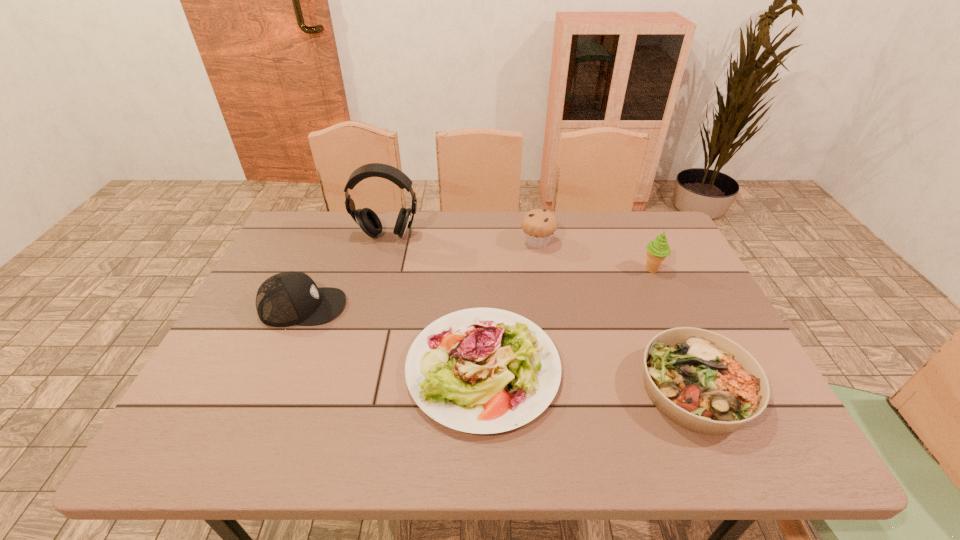
Image resolution: width=960 pixels, height=540 pixels. In the image, there is a desktop. Identify the location of blank space at the near edge. (628, 429).

At what (x,y) coordinates should I click in order to perform the action: click on vacant space at the left edge. Please return your answer as a coordinate pair (x, y). Looking at the image, I should click on (272, 346).

I want to click on vacant space at the right edge, so [x=713, y=308].

In the image, there is a desktop. Where is `vacant space at the far left corner`? This screenshot has height=540, width=960. vacant space at the far left corner is located at coordinates (324, 212).

You are a GUI agent. You are given a task and a screenshot of the screen. Output one action in this format:
    pyautogui.click(x=<x>, y=<y>)
    Task: Click on the vacant area at the near left corner of the desktop
    The height and width of the screenshot is (540, 960).
    Given the screenshot: What is the action you would take?
    pyautogui.click(x=174, y=436)

You are a GUI agent. You are given a task and a screenshot of the screen. Output one action in this format:
    pyautogui.click(x=<x>, y=<y>)
    Task: Click on the free space between the muffin and the right salad plate
    The height and width of the screenshot is (540, 960).
    Given the screenshot: What is the action you would take?
    pyautogui.click(x=616, y=316)

Where is `vacant point located between the muffin and the earphone`? The width and height of the screenshot is (960, 540). vacant point located between the muffin and the earphone is located at coordinates (463, 239).

Where is `free space that is in between the fourth nearest object and the left salad plate`? Image resolution: width=960 pixels, height=540 pixels. free space that is in between the fourth nearest object and the left salad plate is located at coordinates (567, 319).

Where is `vacant space in between the tallest object and the muffin`? vacant space in between the tallest object and the muffin is located at coordinates (463, 239).

Find the location of `empty location between the second tallest object and the cap`. empty location between the second tallest object and the cap is located at coordinates (477, 288).